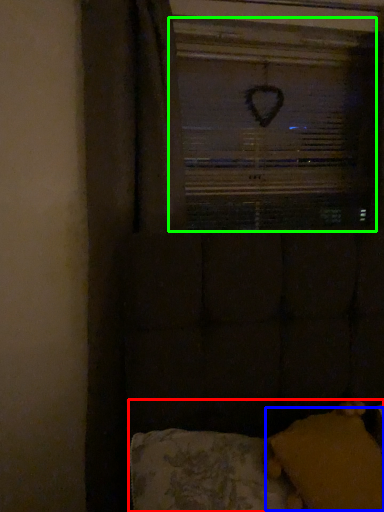
Question: Which is farther away from furniture (highlighted by a red box)? pillow (highlighted by a blue box) or window screen (highlighted by a green box)?

Choices:
 (A) pillow
 (B) window screen

Answer: (B)